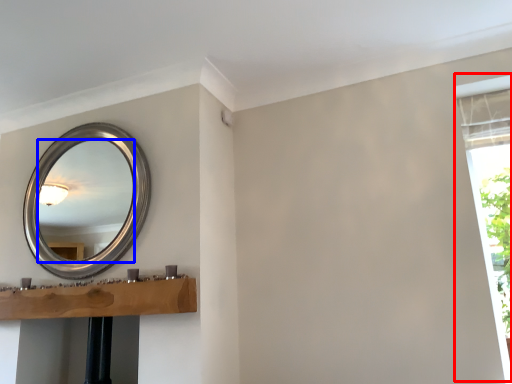
Question: Which object is closer to the camera taking this photo, window frame (highlighted by a red box) or mirror (highlighted by a blue box)?

Choices:
 (A) window frame
 (B) mirror

Answer: (A)